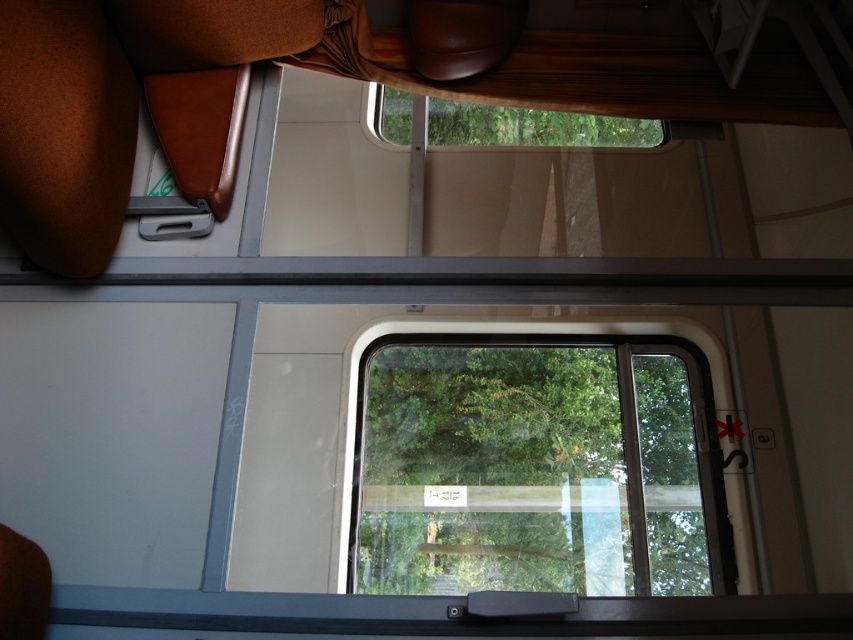
You are a passenger sitting in the train compartment and want to know which of the two windows you can reach easily. The transparent glass window at center and the transparent glass window at upper center are both in front of you. Which one is closer to your seating position?

The transparent glass window at center is much taller than the transparent glass window at upper center, so the transparent glass window at upper center is closer to your seating position.

You are sitting in the train compartment and want to look outside through the transparent glass window at center. Based on the window location, where should you look to see the view outside?

The transparent glass window at center is located at point (537, 468), so you should look towards that coordinate to see the view outside.